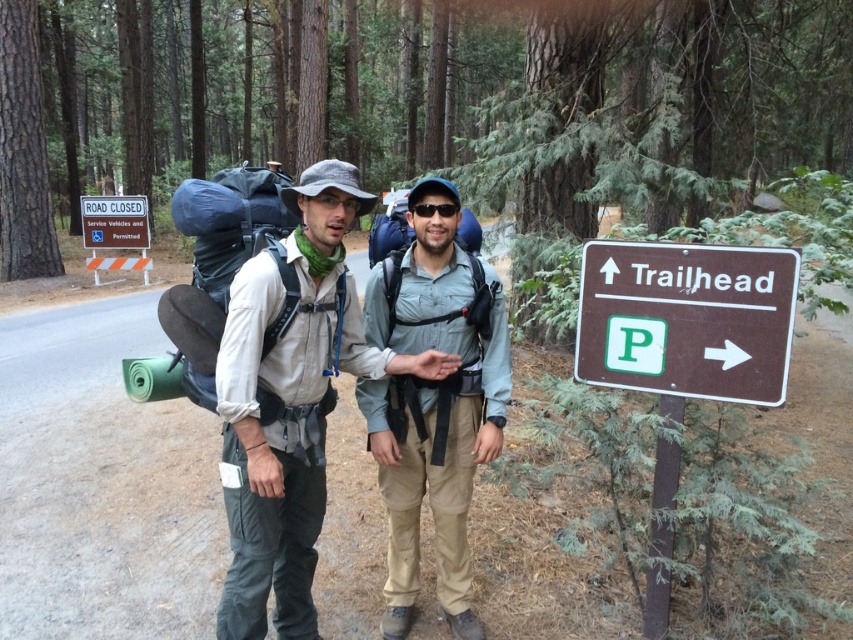
You are a hiker trying to navigate between two points marked in the forest. The first point is at coordinates point (x=479, y=45) and the second is at point (x=142, y=225). Which point is closer to you as you stand at the starting position?

Point (x=479, y=45) is closer to you because it is further to the viewer than point (x=142, y=225), meaning it is nearer in the scene.

You are standing at the center of the image and want to find the brown wooden sign at right. Which direction should you look to see it?

The brown wooden sign at right is located at the right side of the image, so you should look to your right to see it.